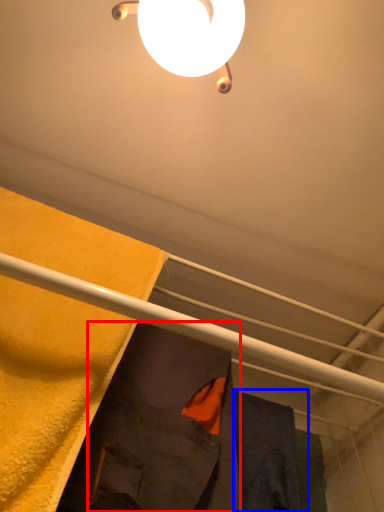
Question: Among these objects, which one is nearest to the camera, robe (highlighted by a red box) or robe (highlighted by a blue box)?

Choices:
 (A) robe
 (B) robe

Answer: (A)